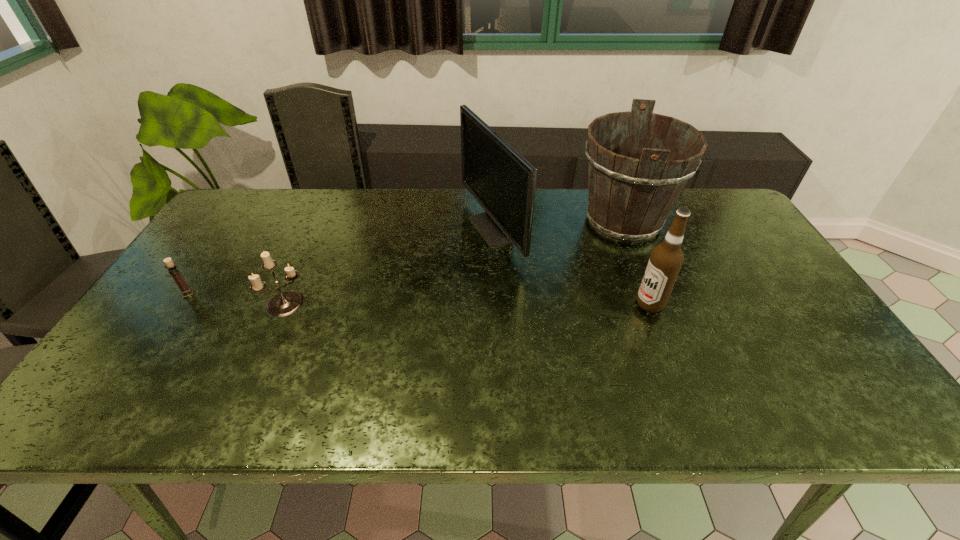
This screenshot has height=540, width=960. Identify the location of free space located 0.110m on the label of the alcohol. (593, 304).

At what (x,y) coordinates should I click in order to perform the action: click on free location located on the label of the alcohol. Please return your answer as a coordinate pair (x, y). This screenshot has height=540, width=960. Looking at the image, I should click on (597, 304).

Find the location of `vacant space situated on the label of the alcohol`. vacant space situated on the label of the alcohol is located at coordinates (551, 304).

The height and width of the screenshot is (540, 960). I want to click on blank area located 0.130m on the front of the fourth object from right to left, so click(262, 363).

The width and height of the screenshot is (960, 540). Find the location of `free space located 0.330m on the right of the shortest object`. free space located 0.330m on the right of the shortest object is located at coordinates (319, 294).

Locate an element on the screen. bucket that is at the far edge is located at coordinates (x=638, y=162).

Find the location of `computer monitor that is at the far edge`. computer monitor that is at the far edge is located at coordinates (503, 182).

Where is `object located at the left edge`? This screenshot has width=960, height=540. object located at the left edge is located at coordinates (173, 269).

In the image, there is a desktop. Find the location of `blank space at the far edge`. blank space at the far edge is located at coordinates (329, 189).

In the image, there is a desktop. Where is `vacant space at the near edge`? vacant space at the near edge is located at coordinates (270, 404).